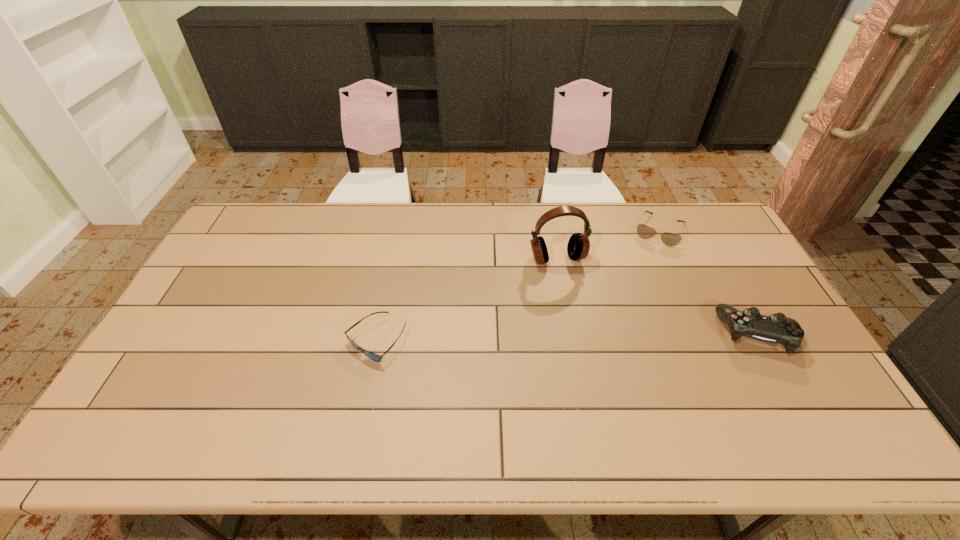
Locate an element on the screen. The width and height of the screenshot is (960, 540). the shorter sunglasses is located at coordinates (373, 356).

At what (x,y) coordinates should I click in order to perform the action: click on the left sunglasses. Please return your answer as a coordinate pair (x, y). The image size is (960, 540). Looking at the image, I should click on (373, 356).

Where is `the third shortest object`? the third shortest object is located at coordinates (777, 328).

The width and height of the screenshot is (960, 540). I want to click on the third object from right to left, so click(x=578, y=247).

What are the coordinates of `the tallest object` in the screenshot? It's located at pos(578,247).

Identify the location of the taller sunglasses. This screenshot has width=960, height=540. (670, 239).

I want to click on the farthest object, so click(670, 239).

I want to click on vacant region located at the front of the nearer sunglasses showing the lenses, so click(363, 407).

Find the location of a particular element. vacant space located on the front of the control is located at coordinates (784, 383).

The image size is (960, 540). I want to click on free location located 0.360m on the ear pads of the tallest object, so click(599, 362).